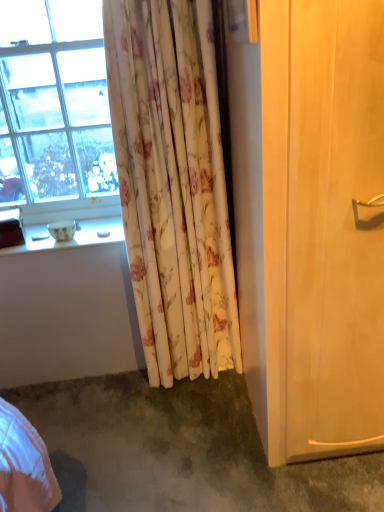
Question: Is floral fabric curtain at center looking in the opposite direction of white glossy window sill at lower left?

Choices:
 (A) yes
 (B) no

Answer: (B)

Question: Is floral fabric curtain at center bigger than white glossy window sill at lower left?

Choices:
 (A) yes
 (B) no

Answer: (A)

Question: Can you confirm if floral fabric curtain at center is shorter than white glossy window sill at lower left?

Choices:
 (A) no
 (B) yes

Answer: (A)

Question: Are floral fabric curtain at center and white glossy window sill at lower left making contact?

Choices:
 (A) no
 (B) yes

Answer: (A)

Question: Can you confirm if floral fabric curtain at center is taller than white glossy window sill at lower left?

Choices:
 (A) yes
 (B) no

Answer: (A)

Question: Is white glossy window sill at lower left inside floral fabric curtain at center?

Choices:
 (A) no
 (B) yes

Answer: (A)

Question: Does gray carpet at lower left have a lesser width compared to white glossy window sill at lower left?

Choices:
 (A) yes
 (B) no

Answer: (B)

Question: Can you confirm if gray carpet at lower left is smaller than white glossy window sill at lower left?

Choices:
 (A) yes
 (B) no

Answer: (B)

Question: Is gray carpet at lower left further to the viewer compared to white glossy window sill at lower left?

Choices:
 (A) yes
 (B) no

Answer: (B)

Question: Is gray carpet at lower left facing towards white glossy window sill at lower left?

Choices:
 (A) yes
 (B) no

Answer: (B)

Question: Is the position of gray carpet at lower left less distant than that of white glossy window sill at lower left?

Choices:
 (A) yes
 (B) no

Answer: (A)

Question: Is gray carpet at lower left wider than white glossy window sill at lower left?

Choices:
 (A) yes
 (B) no

Answer: (A)

Question: Would you say transparent glass window at upper left is outside light wood screen door at right?

Choices:
 (A) no
 (B) yes

Answer: (B)